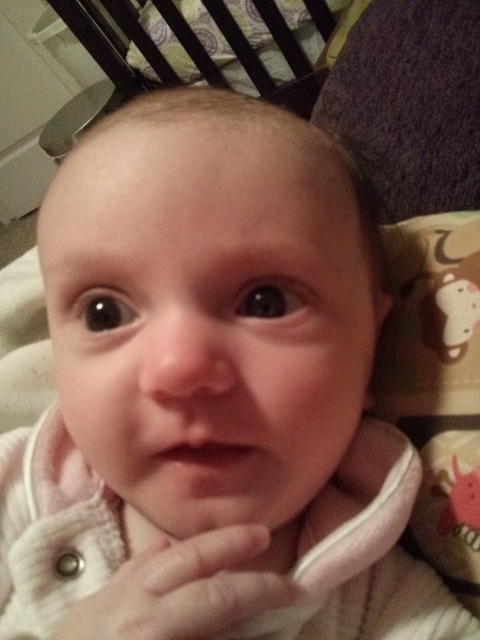
Can you confirm if white soft fabric hand at center is wider than wooden slats at upper center?

No.

Can you confirm if white soft fabric hand at center is shorter than wooden slats at upper center?

Yes, white soft fabric hand at center is shorter than wooden slats at upper center.

Where is `white soft fabric hand at center`? This screenshot has height=640, width=480. white soft fabric hand at center is located at coordinates (181, 589).